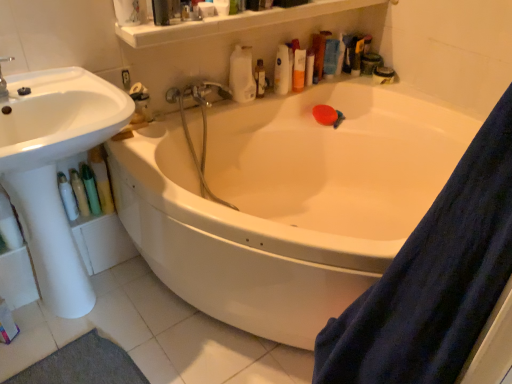
Image resolution: width=512 pixels, height=384 pixels. What do you see at coordinates (79, 192) in the screenshot? I see `translucent plastic toothbrushes at lower left, the 2th toiletry when ordered from bottom to top` at bounding box center [79, 192].

At what (x,y) coordinates should I click in order to perform the action: click on translucent plastic toothbrushes at lower left, positioned as the 2th toiletry in front-to-back order. Please return your answer as a coordinate pair (x, y). This screenshot has height=384, width=512. Looking at the image, I should click on (79, 192).

What is the approximate width of translucent plastic bottle at upper right, the fifth toiletry ordered from the bottom?

translucent plastic bottle at upper right, the fifth toiletry ordered from the bottom, is 6.02 centimeters in width.

Identify the location of white glossy bathtub at center. This screenshot has width=512, height=384. (286, 201).

Describe the element at coordinates (90, 189) in the screenshot. This screenshot has height=384, width=512. I see `green matte tube at lower left, marked as the 3th toiletry in a left-to-right arrangement` at that location.

Measure the distance between white glossy lotion at lower left, which appears as the fifth toiletry when viewed from the right, and camera.

A distance of 1.38 meters exists between white glossy lotion at lower left, which appears as the fifth toiletry when viewed from the right, and camera.

Where is `white glossy lotion at lower left, which appears as the fifth toiletry when viewed from the right`? This screenshot has width=512, height=384. white glossy lotion at lower left, which appears as the fifth toiletry when viewed from the right is located at coordinates (67, 197).

This screenshot has height=384, width=512. Describe the element at coordinates (4, 80) in the screenshot. I see `brushed metal faucet at upper left` at that location.

Image resolution: width=512 pixels, height=384 pixels. I want to click on translucent plastic toothbrushes at lower left, the 4th toiletry from the right, so click(79, 192).

Considering the points (259, 88) and (370, 295), which point is behind, point (259, 88) or point (370, 295)?

Positioned behind is point (259, 88).

Which object is positioned more to the left, translucent plastic bottle at upper center, which is the 4th toiletry from bottom to top, or blue fabric shower curtain at right?

translucent plastic bottle at upper center, which is the 4th toiletry from bottom to top, is more to the left.

Are translucent plastic bottle at upper center, which is the 4th toiletry in front-to-back order, and blue fabric shower curtain at right far apart?

Indeed, translucent plastic bottle at upper center, which is the 4th toiletry in front-to-back order, is not near blue fabric shower curtain at right.

Can you confirm if translucent plastic bottle at upper center, which is counted as the 2th toiletry, starting from the top, is shorter than blue fabric shower curtain at right?

Yes.

Who is smaller, translucent plastic bottle at upper center, the 4th toiletry in the left-to-right sequence, or white glossy lotion at lower left, the fifth toiletry viewed from the top?

translucent plastic bottle at upper center, the 4th toiletry in the left-to-right sequence, is smaller.

Based on their positions, is translucent plastic bottle at upper center, which is counted as the 2th toiletry, starting from the top, located to the left or right of white glossy lotion at lower left, the first toiletry when ordered from left to right?

translucent plastic bottle at upper center, which is counted as the 2th toiletry, starting from the top, is to the right of white glossy lotion at lower left, the first toiletry when ordered from left to right.

Is translucent plastic bottle at upper center, which is the second toiletry from back to front, next to white glossy lotion at lower left, the first toiletry when ordered from left to right, and touching it?

No.

Do you think white glossy sink at left is within white glossy lotion at lower left, the first toiletry when ordered from left to right, or outside of it?

The correct answer is: outside.

Can you see white glossy sink at left touching white glossy lotion at lower left, the first toiletry in the front-to-back sequence?

No.

Does white glossy sink at left have a larger size compared to white glossy lotion at lower left, which appears as the fifth toiletry when viewed from the right?

Yes.

From a real-world perspective, is white glossy sink at left located beneath white glossy lotion at lower left, the first toiletry when ordered from left to right?

No, from a real-world perspective, white glossy sink at left is not under white glossy lotion at lower left, the first toiletry when ordered from left to right.

Which of these two, white glossy lotion at lower left, the first toiletry when ordered from left to right, or white glossy sink at left, is wider?

white glossy sink at left.

From a real-world perspective, between white glossy lotion at lower left, the 1th toiletry in the bottom-to-top sequence, and white glossy sink at left, who is vertically lower?

white glossy lotion at lower left, the 1th toiletry in the bottom-to-top sequence, is physically lower.

How many degrees apart are the facing directions of white glossy lotion at lower left, the first toiletry when ordered from left to right, and white glossy sink at left?

0.000148 degrees.

I want to click on toiletry that is the 1st object located behind the white glossy sink at left, so click(67, 197).

Who is bigger, green matte tube at lower left, the third toiletry when ordered from right to left, or white glossy bathtub at center?

white glossy bathtub at center.

Is point (96, 199) positioned in front of point (320, 274)?

No.

Between green matte tube at lower left, the 3th toiletry in the back-to-front sequence, and white glossy bathtub at center, which one appears on the right side from the viewer's perspective?

Positioned to the right is white glossy bathtub at center.

From the image's perspective, is green matte tube at lower left, the third toiletry viewed from the front, positioned above or below white glossy bathtub at center?

Clearly, from the image's perspective, green matte tube at lower left, the third toiletry viewed from the front, is above white glossy bathtub at center.

From a real-world perspective, is white glossy bathtub at center beneath green matte tube at lower left, arranged as the 3th toiletry when ordered from the bottom?

Yes, from a real-world perspective, white glossy bathtub at center is beneath green matte tube at lower left, arranged as the 3th toiletry when ordered from the bottom.

Is white glossy bathtub at center oriented towards green matte tube at lower left, arranged as the 3th toiletry when ordered from the bottom?

Yes, white glossy bathtub at center is facing green matte tube at lower left, arranged as the 3th toiletry when ordered from the bottom.

In terms of width, does white glossy bathtub at center look wider or thinner when compared to green matte tube at lower left, arranged as the 3th toiletry when ordered from the bottom?

In the image, white glossy bathtub at center appears to be wider than green matte tube at lower left, arranged as the 3th toiletry when ordered from the bottom.

Does white glossy bathtub at center lie in front of green matte tube at lower left, marked as the 3th toiletry in a left-to-right arrangement?

Yes, it is in front of green matte tube at lower left, marked as the 3th toiletry in a left-to-right arrangement.

Which object is more forward, translucent plastic bottles at upper center or translucent plastic toothbrushes at lower left, the fourth toiletry in the top-to-bottom sequence?

translucent plastic bottles at upper center is closer to the camera.

From the picture: Considering the sizes of translucent plastic bottles at upper center and translucent plastic toothbrushes at lower left, the fourth toiletry in the top-to-bottom sequence, in the image, is translucent plastic bottles at upper center taller or shorter than translucent plastic toothbrushes at lower left, the fourth toiletry in the top-to-bottom sequence,?

translucent plastic bottles at upper center is shorter than translucent plastic toothbrushes at lower left, the fourth toiletry in the top-to-bottom sequence.

Considering the relative sizes of translucent plastic bottles at upper center and translucent plastic toothbrushes at lower left, positioned as the 2th toiletry in front-to-back order, in the image provided, is translucent plastic bottles at upper center bigger than translucent plastic toothbrushes at lower left, positioned as the 2th toiletry in front-to-back order,?

Indeed, translucent plastic bottles at upper center has a larger size compared to translucent plastic toothbrushes at lower left, positioned as the 2th toiletry in front-to-back order.

Between translucent plastic bottles at upper center and translucent plastic toothbrushes at lower left, positioned as the 2th toiletry in front-to-back order, which one has larger width?

Wider between the two is translucent plastic bottles at upper center.

You are a GUI agent. You are given a task and a screenshot of the screen. Output one action in this format:
    pyautogui.click(x=<x>, y=<y>)
    Task: Click on the shower curtain to the right of translucent plastic bottle at upper center, the 4th toiletry in the left-to-right sequence
    
    Given the screenshot: What is the action you would take?
    pyautogui.click(x=434, y=278)

Where is `the 3rd toiletry in front of the translucent plastic bottle at upper center, which is the 4th toiletry from bottom to top`? the 3rd toiletry in front of the translucent plastic bottle at upper center, which is the 4th toiletry from bottom to top is located at coordinates (67, 197).

Estimate the real-world distances between objects in this image. Which object is closer to translucent plastic bottle at upper right, acting as the fifth toiletry starting from the left, white glossy sink at left or translucent plastic bottles at upper center?

translucent plastic bottles at upper center.

Looking at the image, which one is located further to metallic chrome faucet at upper center, white glossy lotion at lower left, which appears as the fifth toiletry when viewed from the right, or blue fabric shower curtain at right?

The object further to metallic chrome faucet at upper center is blue fabric shower curtain at right.

Looking at this image, from the image, which object appears to be nearer to white glossy sink at left, green matte tube at lower left, arranged as the 3th toiletry when ordered from the bottom, or translucent plastic bottle at upper center, which is the 4th toiletry in front-to-back order?

Among the two, green matte tube at lower left, arranged as the 3th toiletry when ordered from the bottom, is located nearer to white glossy sink at left.

Which object lies further to the anchor point metallic chrome faucet at upper center, brushed metal faucet at upper left or white glossy lotion at lower left, the first toiletry in the front-to-back sequence?

brushed metal faucet at upper left is further to metallic chrome faucet at upper center.

Based on their spatial positions, is brushed metal faucet at upper left or blue fabric shower curtain at right closer to translucent plastic bottle at upper right, which ranks as the 1th toiletry in back-to-front order?

Based on the image, brushed metal faucet at upper left appears to be nearer to translucent plastic bottle at upper right, which ranks as the 1th toiletry in back-to-front order.

When comparing their distances from green matte tube at lower left, marked as the 3th toiletry in a left-to-right arrangement, does white glossy bathtub at center or white glossy lotion at lower left, the first toiletry when ordered from left to right, seem further?

white glossy bathtub at center is positioned further to the anchor green matte tube at lower left, marked as the 3th toiletry in a left-to-right arrangement.

Estimate the real-world distances between objects in this image. Which object is closer to brushed metal faucet at upper left, metallic chrome faucet at upper center or green matte tube at lower left, the 3th toiletry in the back-to-front sequence?

The object closer to brushed metal faucet at upper left is green matte tube at lower left, the 3th toiletry in the back-to-front sequence.

Looking at the image, which one is located further to white glossy lotion at lower left, the 5th toiletry positioned from the back, white glossy bathtub at center or translucent plastic bottles at upper center?

translucent plastic bottles at upper center is positioned further to the anchor white glossy lotion at lower left, the 5th toiletry positioned from the back.

Where is `tap situated between white glossy lotion at lower left, the 5th toiletry positioned from the back, and white glossy bathtub at center from left to right`? The image size is (512, 384). tap situated between white glossy lotion at lower left, the 5th toiletry positioned from the back, and white glossy bathtub at center from left to right is located at coordinates (198, 92).

The height and width of the screenshot is (384, 512). I want to click on plumbing fixture between white glossy sink at left and translucent plastic bottle at upper center, the second toiletry positioned from the right, in the front-back direction, so click(4, 80).

The image size is (512, 384). Find the location of `balustrade between blue fabric shower curtain at right and green matte tube at lower left, arranged as the 3th toiletry when ordered from the bottom, from front to back`. balustrade between blue fabric shower curtain at right and green matte tube at lower left, arranged as the 3th toiletry when ordered from the bottom, from front to back is located at coordinates (233, 22).

You are a GUI agent. You are given a task and a screenshot of the screen. Output one action in this format:
    pyautogui.click(x=<x>, y=<y>)
    Task: Click on the balustrade between white glossy bathtub at center and translucent plastic bottle at upper center, the 4th toiletry in the left-to-right sequence, from front to back
    The image size is (512, 384).
    Given the screenshot: What is the action you would take?
    pyautogui.click(x=233, y=22)